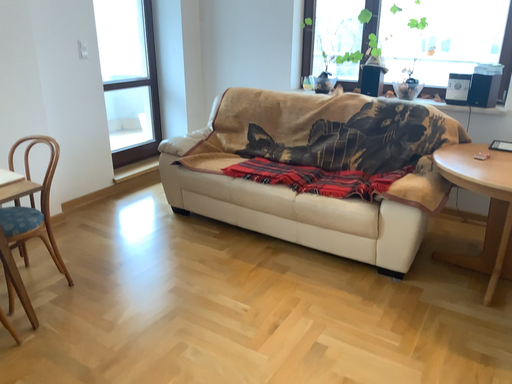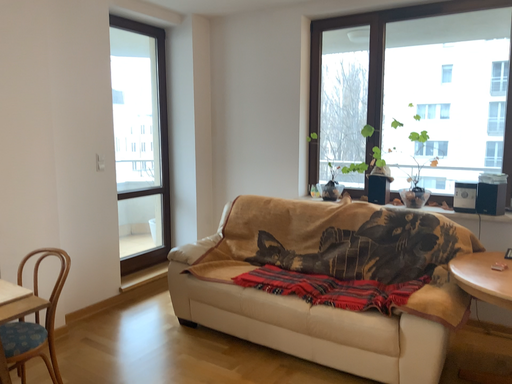
Question: How did the camera likely rotate when shooting the video?

Choices:
 (A) rotated downward
 (B) rotated upward

Answer: (B)